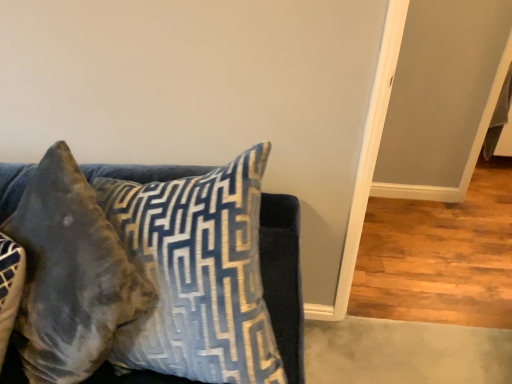
Question: Would you say velvet blue pillow at upper left, which ranks as the second pillow in left-to-right order, is to the left or to the right of velvet brown pillow at left, the 1th pillow in the left-to-right sequence, in the picture?

Choices:
 (A) right
 (B) left

Answer: (A)

Question: Is velvet blue pillow at upper left, the first pillow from the right, inside or outside of velvet brown pillow at left, acting as the 2th pillow starting from the right?

Choices:
 (A) inside
 (B) outside

Answer: (B)

Question: Relative to velvet brown pillow at left, acting as the 2th pillow starting from the right, is velvet blue pillow at upper left, the first pillow from the right, in front or behind?

Choices:
 (A) front
 (B) behind

Answer: (A)

Question: From a real-world perspective, is velvet brown pillow at left, acting as the 2th pillow starting from the right, physically located above or below velvet blue pillow at upper left, which ranks as the second pillow in left-to-right order?

Choices:
 (A) below
 (B) above

Answer: (A)

Question: Based on their positions, is velvet brown pillow at left, acting as the 2th pillow starting from the right, located to the left or right of velvet blue pillow at upper left, which ranks as the second pillow in left-to-right order?

Choices:
 (A) left
 (B) right

Answer: (A)

Question: Considering the positions of velvet brown pillow at left, the 1th pillow in the left-to-right sequence, and velvet blue pillow at upper left, the first pillow from the right, in the image, is velvet brown pillow at left, the 1th pillow in the left-to-right sequence, taller or shorter than velvet blue pillow at upper left, the first pillow from the right,?

Choices:
 (A) short
 (B) tall

Answer: (A)

Question: From the image's perspective, relative to velvet blue pillow at upper left, the first pillow from the right, is velvet brown pillow at left, the 1th pillow in the left-to-right sequence, above or below?

Choices:
 (A) below
 (B) above

Answer: (A)